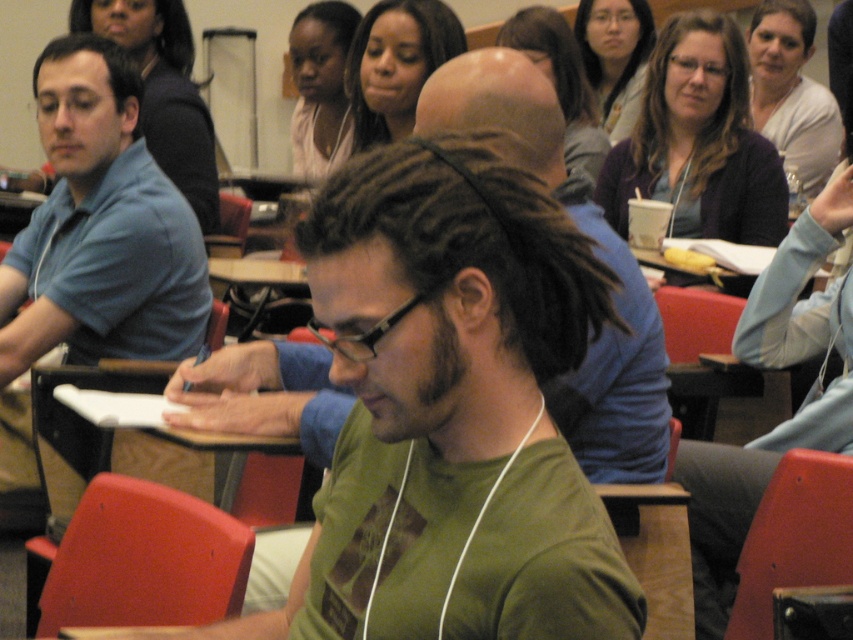
Question: Which is nearer to the matte black shirt at center?

Choices:
 (A) blue cotton shirt at left
 (B) light beige sweater at upper right
 (C) matte black hair at center
 (D) blue shirt at left

Answer: (D)

Question: Estimate the real-world distances between objects in this image. Which object is farther from the matte black hair at upper center?

Choices:
 (A) light beige sweater at upper right
 (B) matte black shirt at center
 (C) matte purple sweater at upper right
 (D) blue shirt at left

Answer: (D)

Question: Considering the relative positions of blue cotton shirt at left and blue shirt at left in the image provided, where is blue cotton shirt at left located with respect to blue shirt at left?

Choices:
 (A) below
 (B) above

Answer: (A)

Question: Does matte purple sweater at upper right have a larger size compared to matte black shirt at center?

Choices:
 (A) no
 (B) yes

Answer: (A)

Question: Can you confirm if blue cotton shirt at left is positioned to the left of matte black shirt at center?

Choices:
 (A) no
 (B) yes

Answer: (B)

Question: Based on their relative distances, which object is farther from the matte black hair at center?

Choices:
 (A) blue shirt at left
 (B) matte black shirt at center

Answer: (A)